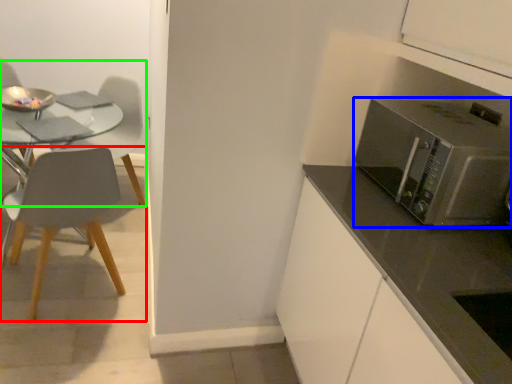
Question: Which is nearer to the chair (highlighted by a red box)? microwave oven (highlighted by a blue box) or chair (highlighted by a green box).

Choices:
 (A) microwave oven
 (B) chair

Answer: (B)